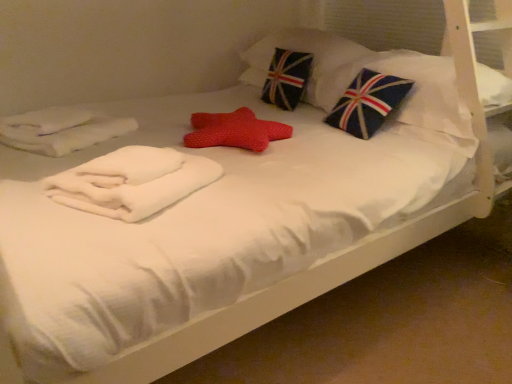
Describe the element at coordinates (411, 96) in the screenshot. The width and height of the screenshot is (512, 384). I see `blue fabric pillow with flag design at upper right, which is counted as the 1th pillow, starting from the front` at that location.

Where is `white soft towel at center`? This screenshot has height=384, width=512. white soft towel at center is located at coordinates (132, 182).

Where is `material beneath the union jack fabric pillow at upper center, which ranks as the 2th pillow in front-to-back order (from a real-world perspective)`? This screenshot has height=384, width=512. material beneath the union jack fabric pillow at upper center, which ranks as the 2th pillow in front-to-back order (from a real-world perspective) is located at coordinates (132, 182).

Which is closer to the camera, (x=99, y=168) or (x=322, y=73)?

Point (x=99, y=168)

Does white soft towel at center have a lesser height compared to union jack fabric pillow at upper center, marked as the 1th pillow in a back-to-front arrangement?

Indeed, white soft towel at center has a lesser height compared to union jack fabric pillow at upper center, marked as the 1th pillow in a back-to-front arrangement.

Is white soft towel at center beside union jack fabric pillow at upper center, which ranks as the 2th pillow in front-to-back order?

white soft towel at center is not next to union jack fabric pillow at upper center, which ranks as the 2th pillow in front-to-back order, and they're not touching.

Is white soft towel at center with blue fabric pillow with flag design at upper right, which is counted as the 1th pillow, starting from the front?

No, white soft towel at center is not next to blue fabric pillow with flag design at upper right, which is counted as the 1th pillow, starting from the front.

From a real-world perspective, between white soft towel at center and blue fabric pillow with flag design at upper right, which is counted as the 1th pillow, starting from the front, who is vertically higher?

From a 3D spatial view, blue fabric pillow with flag design at upper right, which is counted as the 1th pillow, starting from the front, is above.

Measure the distance between white soft towel at center and blue fabric pillow with flag design at upper right, which is counted as the 1th pillow, starting from the front.

The distance of white soft towel at center from blue fabric pillow with flag design at upper right, which is counted as the 1th pillow, starting from the front, is 38.56 inches.

In the image, is white soft towel at center positioned in front of or behind blue fabric pillow with flag design at upper right, positioned as the second pillow in back-to-front order?

Visually, white soft towel at center is located in front of blue fabric pillow with flag design at upper right, positioned as the second pillow in back-to-front order.

Is blue fabric pillow with flag design at upper right, which is counted as the 1th pillow, starting from the front, with white soft towel at center?

No, blue fabric pillow with flag design at upper right, which is counted as the 1th pillow, starting from the front, is not touching white soft towel at center.

Which point is more forward, (327, 109) or (185, 176)?

Positioned in front is point (185, 176).

Does blue fabric pillow with flag design at upper right, which is counted as the 1th pillow, starting from the front, lie behind white soft towel at center?

Yes.

Does blue fabric pillow with flag design at upper right, positioned as the second pillow in back-to-front order, appear on the right side of white soft towel at center?

Yes, blue fabric pillow with flag design at upper right, positioned as the second pillow in back-to-front order, is to the right of white soft towel at center.

Find the location of a particular element. pillow that appears above the blue fabric pillow with flag design at upper right, which is counted as the 1th pillow, starting from the front (from a real-world perspective) is located at coordinates (300, 51).

In terms of height, does blue fabric pillow with flag design at upper right, which is counted as the 1th pillow, starting from the front, look taller or shorter compared to union jack fabric pillow at upper center, which ranks as the 2th pillow in front-to-back order?

In the image, blue fabric pillow with flag design at upper right, which is counted as the 1th pillow, starting from the front, appears to be shorter than union jack fabric pillow at upper center, which ranks as the 2th pillow in front-to-back order.

From the picture: From the image's perspective, which is below, blue fabric pillow with flag design at upper right, which is counted as the 1th pillow, starting from the front, or union jack fabric pillow at upper center, marked as the 1th pillow in a back-to-front arrangement?

blue fabric pillow with flag design at upper right, which is counted as the 1th pillow, starting from the front.

Between point (442, 109) and point (315, 55), which one is positioned behind?

The point (315, 55) is behind.

Considering the sizes of objects union jack fabric pillow at upper center, which ranks as the 2th pillow in front-to-back order, and white soft towel at center in the image provided, who is shorter, union jack fabric pillow at upper center, which ranks as the 2th pillow in front-to-back order, or white soft towel at center?

white soft towel at center.

How distant is union jack fabric pillow at upper center, which ranks as the 2th pillow in front-to-back order, from white soft towel at center?

3.88 feet.

From the image's perspective, which one is positioned lower, union jack fabric pillow at upper center, which ranks as the 2th pillow in front-to-back order, or white soft towel at center?

white soft towel at center appears lower in the image.

Which is less distant, (336, 45) or (120, 168)?

The point (120, 168) is more forward.

From a real-world perspective, between union jack fabric pillow at upper center, which ranks as the 2th pillow in front-to-back order, and blue fabric pillow with flag design at upper right, which is counted as the 1th pillow, starting from the front, who is vertically higher?

In real-world perspective, union jack fabric pillow at upper center, which ranks as the 2th pillow in front-to-back order, is above.

Who is bigger, union jack fabric pillow at upper center, which ranks as the 2th pillow in front-to-back order, or blue fabric pillow with flag design at upper right, positioned as the second pillow in back-to-front order?

union jack fabric pillow at upper center, which ranks as the 2th pillow in front-to-back order, is bigger.

Are union jack fabric pillow at upper center, marked as the 1th pillow in a back-to-front arrangement, and blue fabric pillow with flag design at upper right, positioned as the second pillow in back-to-front order, far apart?

No, union jack fabric pillow at upper center, marked as the 1th pillow in a back-to-front arrangement, is in close proximity to blue fabric pillow with flag design at upper right, positioned as the second pillow in back-to-front order.

Between point (287, 45) and point (430, 139), which one is positioned behind?

The point (287, 45) is behind.

Which pillow is the 2nd one when counting from the back of the white soft towel at center? Please provide its 2D coordinates.

[(300, 51)]

The height and width of the screenshot is (384, 512). What are the coordinates of `material in front of the blue fabric pillow with flag design at upper right, positioned as the second pillow in back-to-front order` in the screenshot? It's located at (132, 182).

Considering their positions, is union jack fabric pillow at upper center, which ranks as the 2th pillow in front-to-back order, positioned further to white soft towel at center than blue fabric pillow with flag design at upper right, positioned as the second pillow in back-to-front order?

union jack fabric pillow at upper center, which ranks as the 2th pillow in front-to-back order, lies further to white soft towel at center than the other object.

Based on their spatial positions, is white soft towel at center or union jack fabric pillow at upper center, which ranks as the 2th pillow in front-to-back order, closer to blue fabric pillow with flag design at upper right, which is counted as the 1th pillow, starting from the front?

union jack fabric pillow at upper center, which ranks as the 2th pillow in front-to-back order.

When comparing their distances from union jack fabric pillow at upper center, marked as the 1th pillow in a back-to-front arrangement, does white soft towel at center or blue fabric pillow with flag design at upper right, positioned as the second pillow in back-to-front order, seem closer?

blue fabric pillow with flag design at upper right, positioned as the second pillow in back-to-front order, is positioned closer to the anchor union jack fabric pillow at upper center, marked as the 1th pillow in a back-to-front arrangement.

Based on the photo, looking at the image, which one is located further to blue fabric pillow with flag design at upper right, positioned as the second pillow in back-to-front order, union jack fabric pillow at upper center, marked as the 1th pillow in a back-to-front arrangement, or white soft towel at center?

white soft towel at center is positioned further to the anchor blue fabric pillow with flag design at upper right, positioned as the second pillow in back-to-front order.

Considering their positions, is blue fabric pillow with flag design at upper right, positioned as the second pillow in back-to-front order, positioned closer to white soft towel at center than union jack fabric pillow at upper center, which ranks as the 2th pillow in front-to-back order?

blue fabric pillow with flag design at upper right, positioned as the second pillow in back-to-front order, is positioned closer to the anchor white soft towel at center.

When comparing their distances from union jack fabric pillow at upper center, which ranks as the 2th pillow in front-to-back order, does blue fabric pillow with flag design at upper right, positioned as the second pillow in back-to-front order, or white soft towel at center seem closer?

The object closer to union jack fabric pillow at upper center, which ranks as the 2th pillow in front-to-back order, is blue fabric pillow with flag design at upper right, positioned as the second pillow in back-to-front order.

The height and width of the screenshot is (384, 512). I want to click on pillow located between white soft towel at center and blue fabric pillow with flag design at upper right, positioned as the second pillow in back-to-front order, in the left-right direction, so click(x=300, y=51).